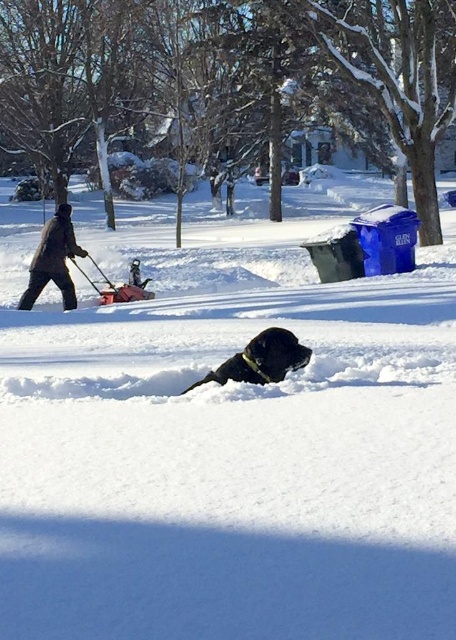
Question: Is white fluffy snow at center behind black matte dog at center?

Choices:
 (A) yes
 (B) no

Answer: (B)

Question: Among these objects, which one is nearest to the camera?

Choices:
 (A) white fluffy snow at center
 (B) black matte dog at center
 (C) dark brown jacket at left

Answer: (A)

Question: Observing the image, what is the correct spatial positioning of black matte dog at center in reference to dark brown jacket at left?

Choices:
 (A) right
 (B) left

Answer: (A)

Question: Which point is closer to the camera?

Choices:
 (A) (310, 349)
 (B) (67, 296)

Answer: (A)

Question: Which point appears closest to the camera in this image?

Choices:
 (A) (87, 253)
 (B) (288, 333)
 (C) (258, 225)

Answer: (B)

Question: In this image, where is black matte dog at center located relative to dark brown jacket at left?

Choices:
 (A) above
 (B) below

Answer: (B)